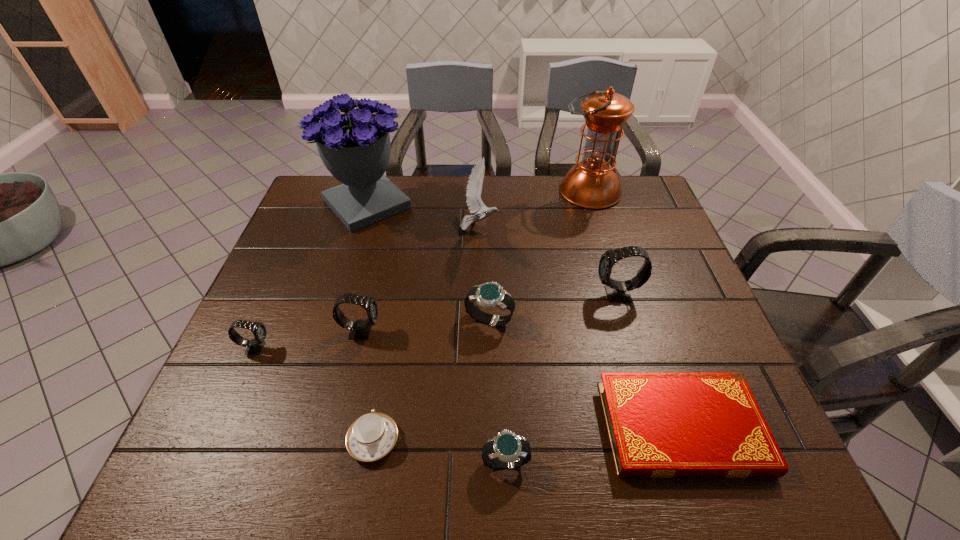
Where is `vacant space at the far right corner of the desktop`? vacant space at the far right corner of the desktop is located at coordinates (640, 185).

At what (x,y) coordinates should I click in order to perform the action: click on free space between the shortest object and the second smallest gray watch. Please return your answer as a coordinate pair (x, y). Image resolution: width=960 pixels, height=540 pixels. Looking at the image, I should click on (521, 379).

This screenshot has height=540, width=960. What are the coordinates of `vacant space that is in between the white gull and the farther silver watch` in the screenshot? It's located at (485, 274).

Locate an element on the screen. This screenshot has width=960, height=540. vacant area that lies between the white gull and the hardback book is located at coordinates (581, 328).

Find the location of a particular element. The width and height of the screenshot is (960, 540). vacant space that is in between the shortest object and the leftmost watch is located at coordinates (468, 388).

Find the location of a particular element. free space between the nearest watch and the purple bouquet is located at coordinates (436, 333).

This screenshot has width=960, height=540. I want to click on blank region between the smallest gray watch and the hardback book, so click(468, 388).

Where is `vacant space in between the blue teacup and the leftmost gray watch`? vacant space in between the blue teacup and the leftmost gray watch is located at coordinates (315, 394).

Where is `free point between the hardback book and the bigger silver watch`? free point between the hardback book and the bigger silver watch is located at coordinates (586, 373).

Find the location of a particular element. The image size is (960, 540). vacant area that lies between the smaller silver watch and the sixth shortest object is located at coordinates (433, 396).